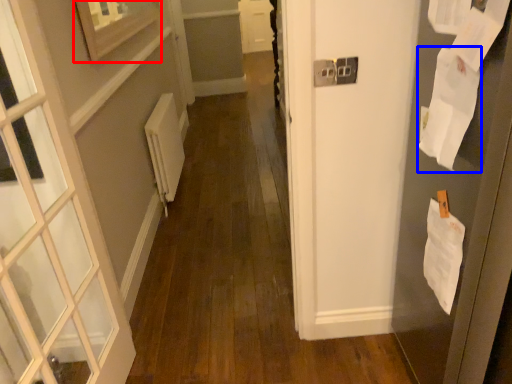
Question: Which of the following is the closest to the observer, picture frame (highlighted by a red box) or paper (highlighted by a blue box)?

Choices:
 (A) picture frame
 (B) paper

Answer: (B)